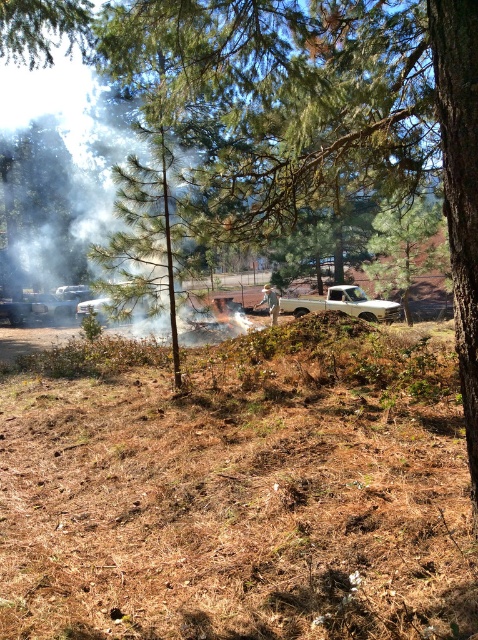
You are a firefighter assessing a wildfire scene. You see brown dry grass at center and a white matte truck at center. How far apart are these two objects?

The distance between the brown dry grass at center and the white matte truck at center is 18.51 meters.

You are standing at the point marked as point (43, 29) in the forest scene. Which object from the scene is directly beneath your feet?

The point (43, 29) is on the green leafy tree at upper left, so the object directly beneath your feet is the green leafy tree at upper left.

You are a hiker who wants to take a photo of the white matte truck at center while avoiding the brown dry grass at center appearing in the shot. Is it possible to position yourself in a way that the truck is visible but the grass is not?

The brown dry grass at center is closer to the viewer than the white matte truck at center, so by moving your position to block or exclude the closer grass from the frame while keeping the truck in view, it is possible to take such a photo.